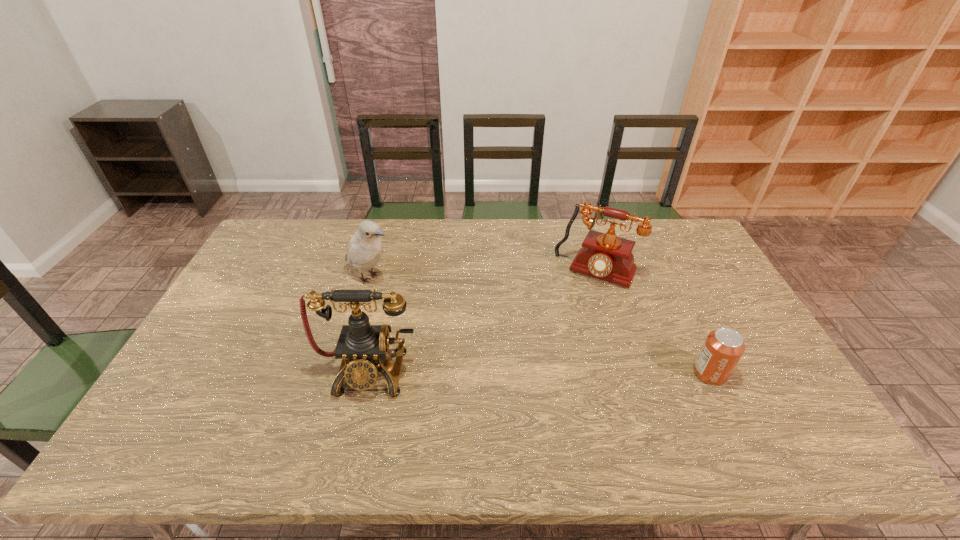
This screenshot has height=540, width=960. I want to click on vacant space on the desktop that is between the nearer telephone and the can and is positioned on the dial of the right telephone, so pyautogui.click(x=548, y=372).

The height and width of the screenshot is (540, 960). What are the coordinates of `vacant space on the desktop that is between the left telephone and the shortest object and is positioned at the beak of the bird` in the screenshot? It's located at (554, 372).